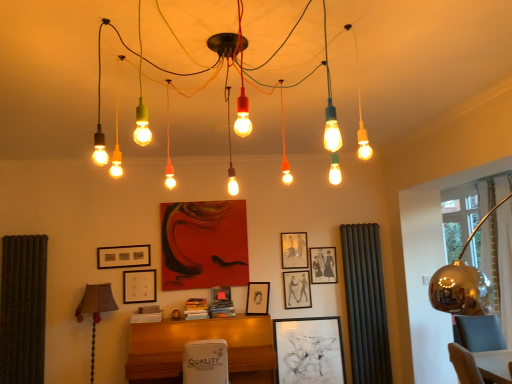
Where is `empty space that is ontop of multicolored glass bulbs at center (from a real-world perspective)`? empty space that is ontop of multicolored glass bulbs at center (from a real-world perspective) is located at coordinates (204, 45).